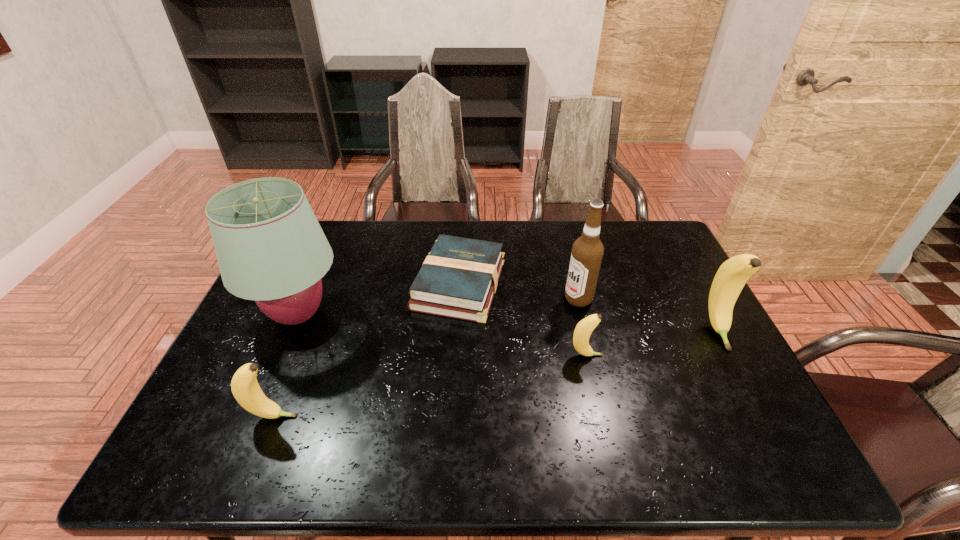
Where is `free space between the fourth tallest object and the alcohol`? Image resolution: width=960 pixels, height=540 pixels. free space between the fourth tallest object and the alcohol is located at coordinates (426, 357).

Identify the location of free space between the leftmost banana and the lampshade. (x=286, y=366).

Find the location of a particular element. free space between the alcohol and the shortest object is located at coordinates pos(518,292).

This screenshot has width=960, height=540. Find the location of `vacant area that lies between the second banana from left to right and the third shortest object`. vacant area that lies between the second banana from left to right and the third shortest object is located at coordinates tap(430, 386).

Where is `free spot between the third tallest object and the lampshade`? This screenshot has height=540, width=960. free spot between the third tallest object and the lampshade is located at coordinates (508, 322).

Where is `free spot between the tallest banana and the hardback book`? free spot between the tallest banana and the hardback book is located at coordinates click(588, 307).

Locate which object is the closest to the alcohol. Please provide its 2D coordinates. Your answer should be formatted as a tuple, i.e. [(x, y)], where the tuple contains the x and y coordinates of a point satisfying the conditions above.

[(583, 330)]

Locate which object is the closest to the fourth shortest object. Please provide its 2D coordinates. Your answer should be formatted as a tuple, i.e. [(x, y)], where the tuple contains the x and y coordinates of a point satisfying the conditions above.

[(587, 252)]

Identify which banana is the second closest to the alcohol. Please provide its 2D coordinates. Your answer should be formatted as a tuple, i.e. [(x, y)], where the tuple contains the x and y coordinates of a point satisfying the conditions above.

[(732, 275)]

Locate an element on the screen. This screenshot has width=960, height=540. banana that stands as the second closest to the rightmost object is located at coordinates (244, 385).